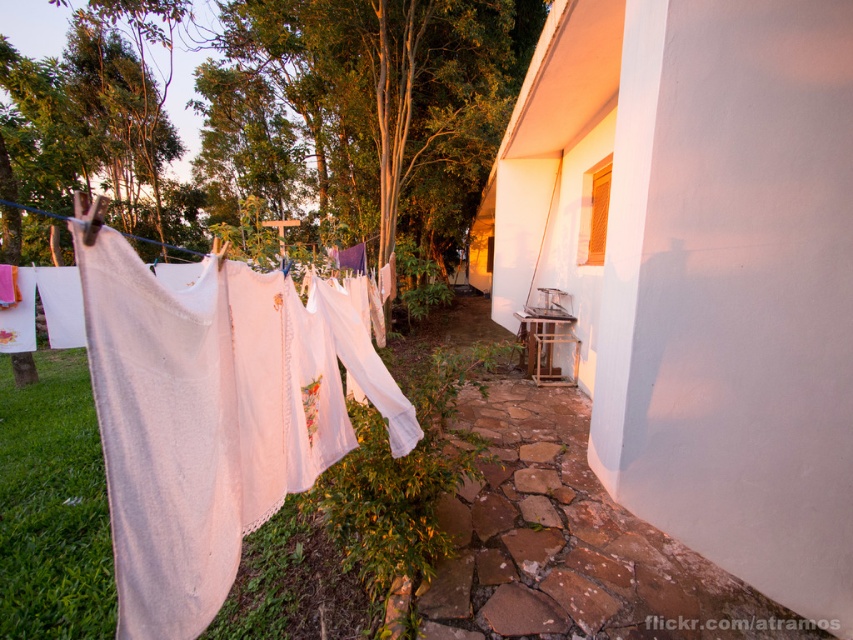
You are standing in the residential area and looking at the clothesline between two points. Which point is closer to you, the point at coordinate [244,172] or the point at coordinate [268,312]?

Point [268,312] is closer to you because it is less further to the camera than point [244,172].

You are standing in the yard looking at the green leafy tree at upper left and the white cotton laundry at left. Which object is higher up in the air?

The green leafy tree at upper left is taller than the white cotton laundry at left, so the green leafy tree at upper left is higher up in the air.

You are standing in the residential area shown in the image. You need to determine if the green leafy tree at upper left can block the view of the white cotton laundry at left when looking from the building on the right. Can it?

The green leafy tree at upper left might be wider than the white cotton laundry at left, so it could potentially block the view depending on their exact positions and angles.